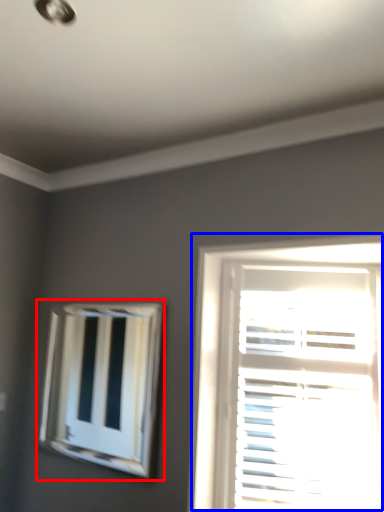
Question: Which object is closer to the camera taking this photo, bay window (highlighted by a red box) or window (highlighted by a blue box)?

Choices:
 (A) bay window
 (B) window

Answer: (B)